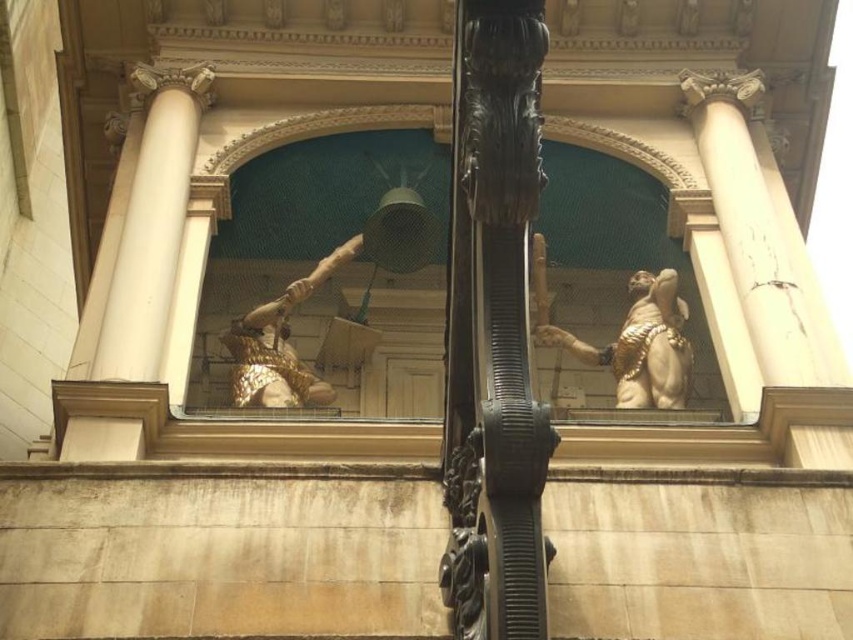
Image resolution: width=853 pixels, height=640 pixels. Describe the element at coordinates (494, 330) in the screenshot. I see `black polished wood at center` at that location.

Which is in front, point (476, 141) or point (283, 368)?

Point (476, 141) is in front.

Where is `black polished wood at center`? The height and width of the screenshot is (640, 853). black polished wood at center is located at coordinates (494, 330).

Can you confirm if black polished wood at center is positioned to the right of gold polished statue at center?

Incorrect, black polished wood at center is not on the right side of gold polished statue at center.

Does black polished wood at center appear on the left side of gold polished statue at center?

Yes, black polished wood at center is to the left of gold polished statue at center.

Locate an element on the screen. black polished wood at center is located at coordinates (494, 330).

Is white marble column at left smaller than gold textured armor at center?

No, white marble column at left is not smaller than gold textured armor at center.

Measure the distance between point (180,128) and camera.

Point (180,128) and camera are 60.71 meters apart.

The height and width of the screenshot is (640, 853). Find the location of `white marble column at left`. white marble column at left is located at coordinates (135, 266).